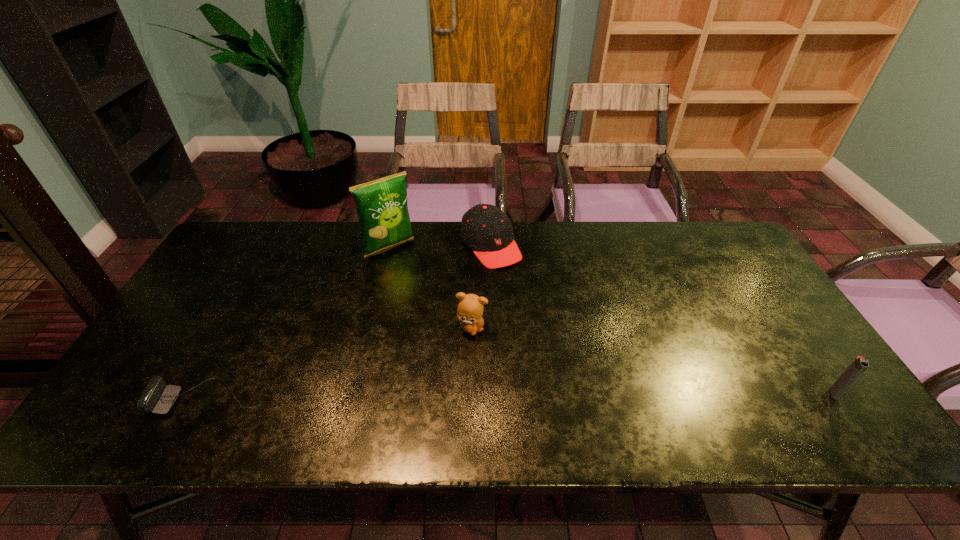
Identify the location of free space located on the face of the third farthest object. (512, 370).

Find the location of a particular element. The height and width of the screenshot is (540, 960). vacant area situated 0.080m on the face of the third farthest object is located at coordinates (499, 356).

Image resolution: width=960 pixels, height=540 pixels. I want to click on vacant space situated on the face of the third farthest object, so click(x=516, y=375).

Where is `blank space located on the front-facing side of the cap`? The height and width of the screenshot is (540, 960). blank space located on the front-facing side of the cap is located at coordinates (574, 356).

Where is `vacant position located 0.180m on the front-facing side of the cap`? vacant position located 0.180m on the front-facing side of the cap is located at coordinates (534, 305).

The height and width of the screenshot is (540, 960). I want to click on free region located 0.160m on the front-facing side of the cap, so click(531, 301).

The image size is (960, 540). Find the location of `free point located 0.060m on the front-facing side of the crisp (potato chip)`. free point located 0.060m on the front-facing side of the crisp (potato chip) is located at coordinates (409, 267).

In order to click on free space located on the front-facing side of the crisp (potato chip) in this screenshot , I will do `click(458, 325)`.

Locate an element on the screen. vacant space located on the front-facing side of the crisp (potato chip) is located at coordinates (458, 325).

The height and width of the screenshot is (540, 960). Find the location of `cap at the far edge`. cap at the far edge is located at coordinates coord(485,229).